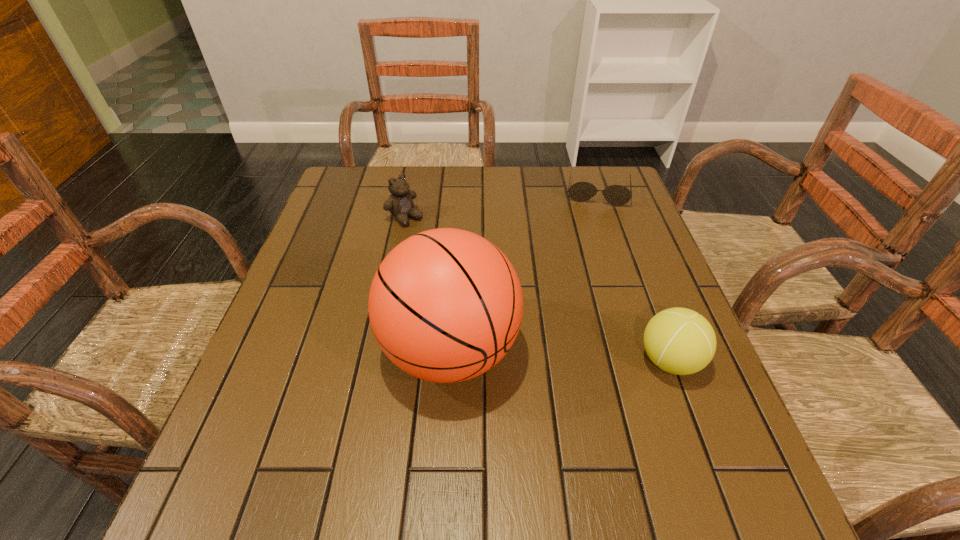
Locate an element on the screen. vacant point located on the front-facing side of the shortest object is located at coordinates (594, 218).

The height and width of the screenshot is (540, 960). What are the coordinates of `free location located 0.220m on the front-facing side of the shortest object` in the screenshot? It's located at (591, 258).

At what (x,y) coordinates should I click in order to perform the action: click on teddy bear located in the far edge section of the desktop. Please return your answer as a coordinate pair (x, y). Looking at the image, I should click on (400, 204).

Find the location of a particular element. The width and height of the screenshot is (960, 540). sunglasses positioned at the far edge is located at coordinates (617, 195).

At what (x,y) coordinates should I click in order to perform the action: click on object located in the near edge section of the desktop. Please return your answer as a coordinate pair (x, y). The image size is (960, 540). Looking at the image, I should click on (445, 305).

The width and height of the screenshot is (960, 540). What are the coordinates of `tennis ball present at the right edge` in the screenshot? It's located at (680, 341).

Where is `sunglasses at the right edge`? Image resolution: width=960 pixels, height=540 pixels. sunglasses at the right edge is located at coordinates (617, 195).

This screenshot has width=960, height=540. Find the location of `object that is at the far right corner`. object that is at the far right corner is located at coordinates (617, 195).

Find the location of `blank area at the far edge`. blank area at the far edge is located at coordinates (498, 169).

In the image, there is a desktop. At what (x,y) coordinates should I click in order to perform the action: click on vacant space at the near edge. Please return your answer as a coordinate pair (x, y). Image resolution: width=960 pixels, height=540 pixels. Looking at the image, I should click on [x=583, y=426].